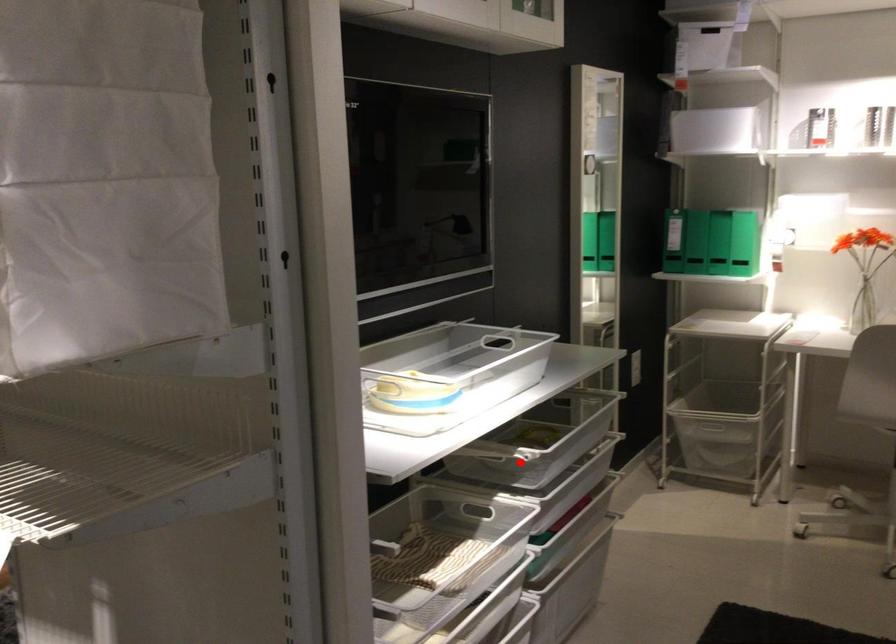
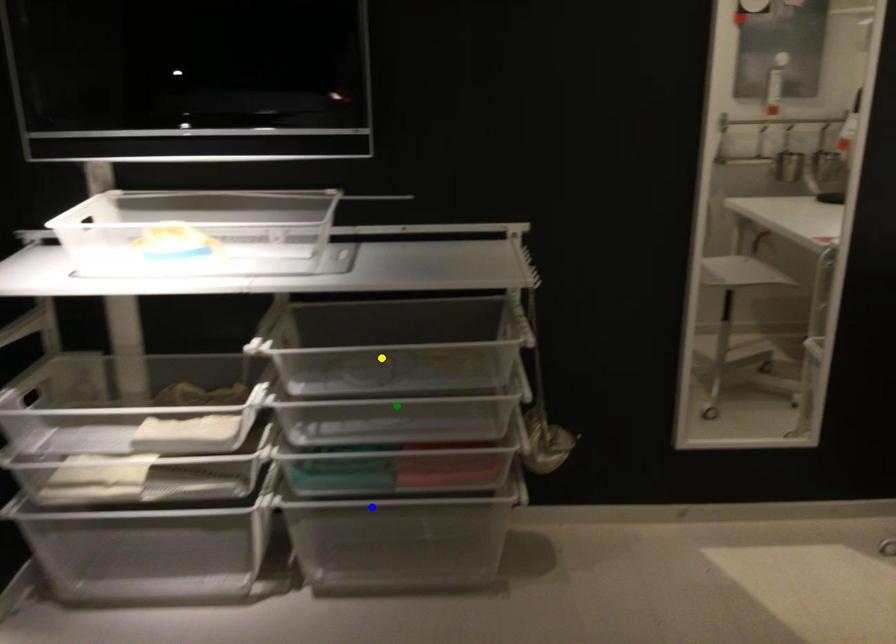
Question: I am providing you with two images of the same scene from different viewpoints. A red point is marked on the first image. You are given multiple points on the second image. Which spot in image 2 lines up with the point in image 1?

Choices:
 (A) blue point
 (B) green point
 (C) yellow point

Answer: (B)